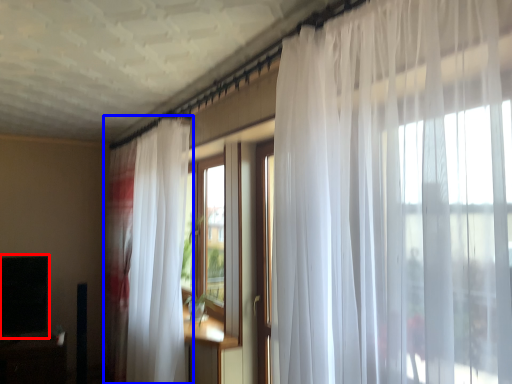
Question: Which point is further to the camera, window screen (highlighted by a red box) or curtain (highlighted by a blue box)?

Choices:
 (A) window screen
 (B) curtain

Answer: (A)